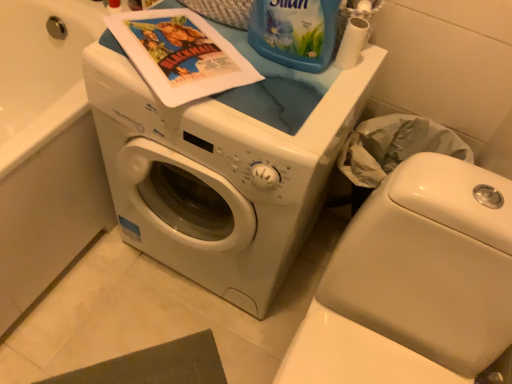
Question: Is matte paper comic book at upper center shorter than white glossy washing machine at center?

Choices:
 (A) no
 (B) yes

Answer: (B)

Question: Is matte paper comic book at upper center smaller than white glossy washing machine at center?

Choices:
 (A) yes
 (B) no

Answer: (A)

Question: Is the position of matte paper comic book at upper center more distant than that of white glossy washing machine at center?

Choices:
 (A) yes
 (B) no

Answer: (A)

Question: Does matte paper comic book at upper center have a greater height compared to white glossy washing machine at center?

Choices:
 (A) yes
 (B) no

Answer: (B)

Question: Is matte paper comic book at upper center to the right of white glossy washing machine at center from the viewer's perspective?

Choices:
 (A) yes
 (B) no

Answer: (B)

Question: Considering their positions, is blue plastic bottle at upper center located in front of or behind matte paper comic book at upper center?

Choices:
 (A) front
 (B) behind

Answer: (A)

Question: Is blue plastic bottle at upper center inside the boundaries of matte paper comic book at upper center, or outside?

Choices:
 (A) outside
 (B) inside

Answer: (A)

Question: In terms of size, does blue plastic bottle at upper center appear bigger or smaller than matte paper comic book at upper center?

Choices:
 (A) small
 (B) big

Answer: (B)

Question: From the image's perspective, relative to matte paper comic book at upper center, is blue plastic bottle at upper center above or below?

Choices:
 (A) above
 (B) below

Answer: (A)

Question: In terms of height, does blue plastic bottle at upper center look taller or shorter compared to white matte toilet paper at upper right?

Choices:
 (A) tall
 (B) short

Answer: (A)

Question: Would you say blue plastic bottle at upper center is to the left or to the right of white matte toilet paper at upper right in the picture?

Choices:
 (A) right
 (B) left

Answer: (B)

Question: Considering the positions of blue plastic bottle at upper center and white matte toilet paper at upper right in the image, is blue plastic bottle at upper center wider or thinner than white matte toilet paper at upper right?

Choices:
 (A) wide
 (B) thin

Answer: (A)

Question: Based on their sizes in the image, would you say blue plastic bottle at upper center is bigger or smaller than white matte toilet paper at upper right?

Choices:
 (A) big
 (B) small

Answer: (A)

Question: Do you think white glossy washer at lower left is within blue plastic bottle at upper center, or outside of it?

Choices:
 (A) outside
 (B) inside

Answer: (A)

Question: From a real-world perspective, is white glossy washer at lower left above or below blue plastic bottle at upper center?

Choices:
 (A) below
 (B) above

Answer: (A)